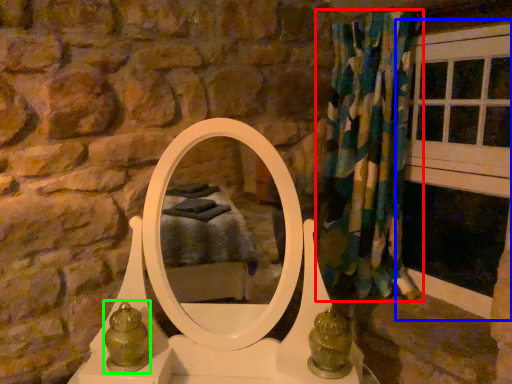
Question: Based on their relative distances, which object is farther from curtain (highlighted by a red box)? Choose from window frame (highlighted by a blue box) and antique (highlighted by a green box).

Choices:
 (A) window frame
 (B) antique

Answer: (B)